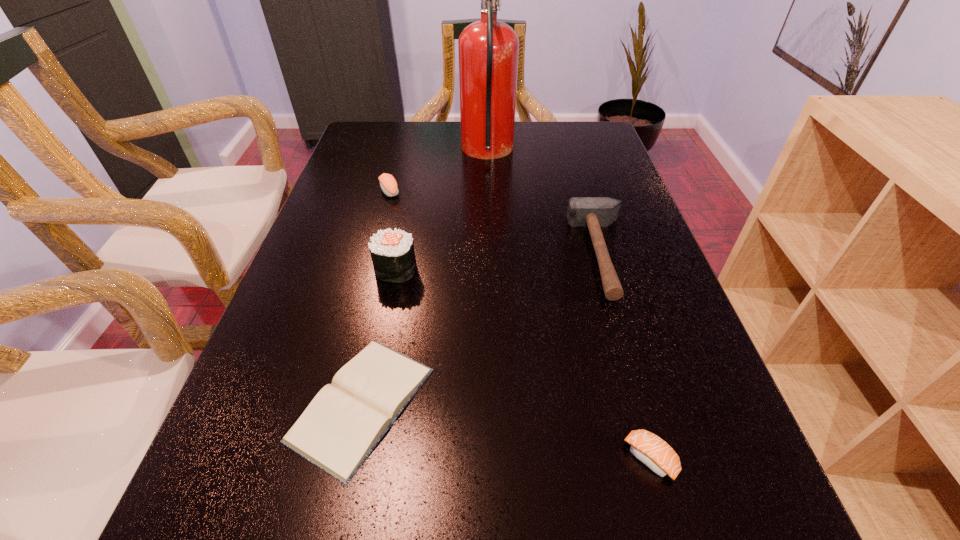
Identify the location of vacant area situated with the handle and nozzle on the fire extinguisher. (408, 152).

You are a GUI agent. You are given a task and a screenshot of the screen. Output one action in this format:
    pyautogui.click(x=<x>, y=<y>)
    Task: Click on the vacant area situated with the handle and nozzle on the fire extinguisher
    The width and height of the screenshot is (960, 540).
    Given the screenshot: What is the action you would take?
    pyautogui.click(x=441, y=152)

Find the location of `free space located with the handle and nozzle on the fire extinguisher`. free space located with the handle and nozzle on the fire extinguisher is located at coordinates (431, 152).

The image size is (960, 540). I want to click on free space located on the front of the second farthest sushi, so click(386, 315).

You are a GUI agent. You are given a task and a screenshot of the screen. Output one action in this format:
    pyautogui.click(x=<x>, y=<y>)
    Task: Click on the free location located 0.220m on the striking surface of the hammer
    The height and width of the screenshot is (540, 960).
    Given the screenshot: What is the action you would take?
    pyautogui.click(x=478, y=254)

Locate an element on the screen. The height and width of the screenshot is (540, 960). blank space located 0.050m on the striking surface of the hammer is located at coordinates (553, 254).

You are a GUI agent. You are given a task and a screenshot of the screen. Output one action in this format:
    pyautogui.click(x=<x>, y=<y>)
    Task: Click on the vacant space located 0.350m on the striking surface of the hammer
    
    Given the screenshot: What is the action you would take?
    pyautogui.click(x=420, y=254)

This screenshot has height=540, width=960. In order to click on vacant space located 0.090m on the back of the farthest sushi in this screenshot , I will do pos(396,165).

Where is `vacant area located 0.140m on the back of the shortest sushi`? This screenshot has width=960, height=540. vacant area located 0.140m on the back of the shortest sushi is located at coordinates (622, 361).

The height and width of the screenshot is (540, 960). I want to click on free space located on the back of the Bible, so click(401, 219).